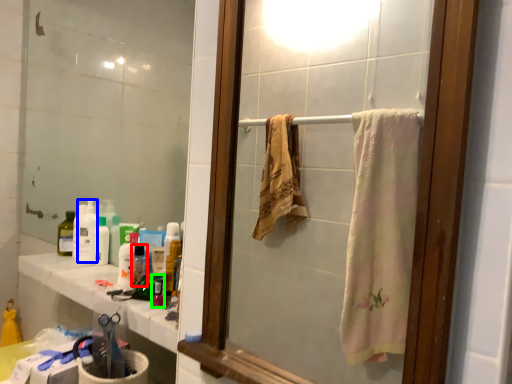
Question: Which object is positioned farthest from bottle (highlighted by a red box)? Select from cleaning product (highlighted by a blue box) and mouthwash (highlighted by a green box).

Choices:
 (A) cleaning product
 (B) mouthwash

Answer: (A)